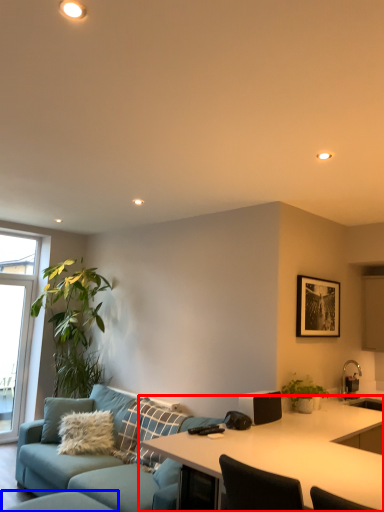
Question: Which point is further to the camera, desk (highlighted by a red box) or swivel chair (highlighted by a blue box)?

Choices:
 (A) desk
 (B) swivel chair

Answer: (B)